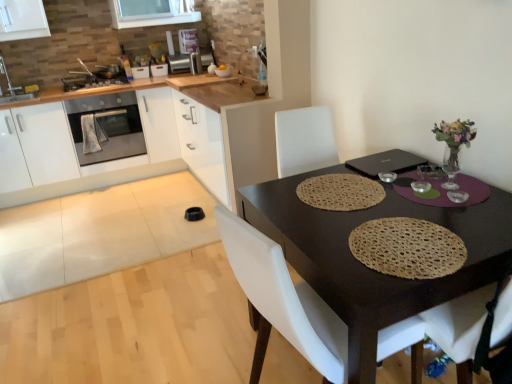
This screenshot has height=384, width=512. Identify the location of free space behind woven beige placemat at table center. (368, 201).